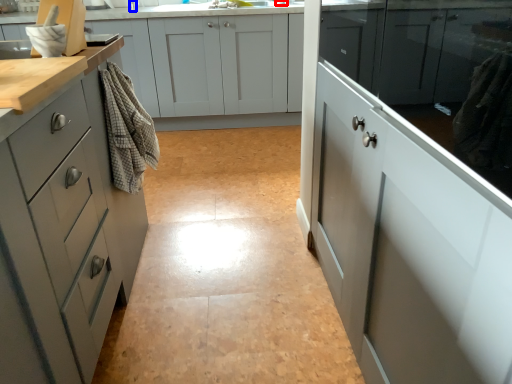
Question: Which point is closer to the camera, faucet (highlighted by a red box) or faucet (highlighted by a blue box)?

Choices:
 (A) faucet
 (B) faucet

Answer: (A)